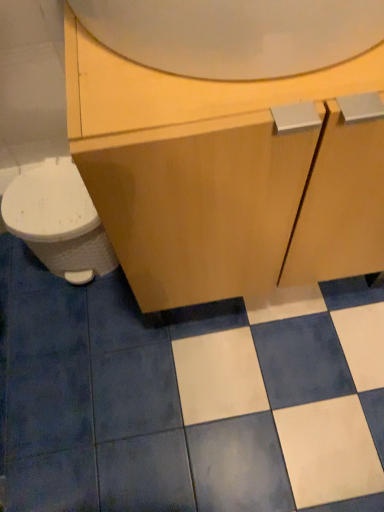
Question: Considering the relative sizes of white glossy toilet at left and matte wood cabinet at center in the image provided, is white glossy toilet at left wider than matte wood cabinet at center?

Choices:
 (A) no
 (B) yes

Answer: (A)

Question: Does white glossy toilet at left have a lesser width compared to matte wood cabinet at center?

Choices:
 (A) yes
 (B) no

Answer: (A)

Question: Would you say white glossy toilet at left is a long distance from matte wood cabinet at center?

Choices:
 (A) yes
 (B) no

Answer: (B)

Question: Is the position of white glossy toilet at left less distant than that of matte wood cabinet at center?

Choices:
 (A) yes
 (B) no

Answer: (B)

Question: Is white glossy toilet at left oriented away from matte wood cabinet at center?

Choices:
 (A) no
 (B) yes

Answer: (A)

Question: Considering the positions of white glossy tile at center and matte wood cabinet at center in the image, is white glossy tile at center taller or shorter than matte wood cabinet at center?

Choices:
 (A) tall
 (B) short

Answer: (B)

Question: From the image's perspective, is white glossy tile at center above or below matte wood cabinet at center?

Choices:
 (A) above
 (B) below

Answer: (B)

Question: Considering the positions of white glossy tile at center and matte wood cabinet at center in the image, is white glossy tile at center bigger or smaller than matte wood cabinet at center?

Choices:
 (A) big
 (B) small

Answer: (B)

Question: Considering the positions of point (309, 402) and point (150, 170), is point (309, 402) closer or farther from the camera than point (150, 170)?

Choices:
 (A) closer
 (B) farther

Answer: (B)

Question: Considering their positions, is matte wood cabinet at center located in front of or behind white glossy tile at center?

Choices:
 (A) behind
 (B) front

Answer: (B)

Question: In terms of height, does matte wood cabinet at center look taller or shorter compared to white glossy tile at center?

Choices:
 (A) short
 (B) tall

Answer: (B)

Question: Is matte wood cabinet at center bigger or smaller than white glossy tile at center?

Choices:
 (A) small
 (B) big

Answer: (B)

Question: Is matte wood cabinet at center wider or thinner than white glossy tile at center?

Choices:
 (A) wide
 (B) thin

Answer: (B)

Question: From the image's perspective, is white glossy toilet at left above or below white glossy tile at center?

Choices:
 (A) below
 (B) above

Answer: (B)

Question: From their relative heights in the image, would you say white glossy toilet at left is taller or shorter than white glossy tile at center?

Choices:
 (A) short
 (B) tall

Answer: (B)